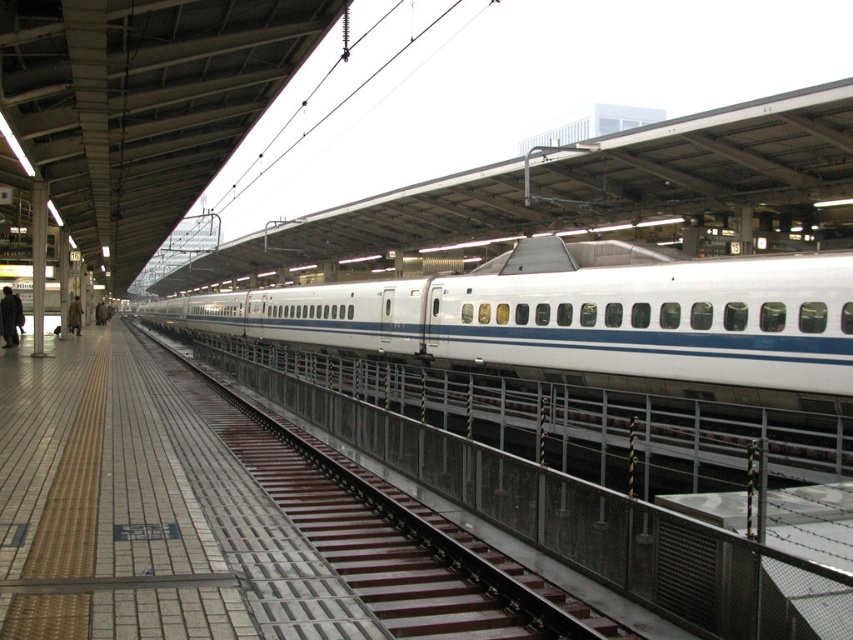
Question: Is dark clothing at platform left thinner than brown leather coat at left?

Choices:
 (A) yes
 (B) no

Answer: (A)

Question: Is white smooth passenger train at center wider than dark clothing at platform left?

Choices:
 (A) no
 (B) yes

Answer: (B)

Question: Which of these objects is positioned closest to the white smooth passenger train at center?

Choices:
 (A) dark clothing at platform left
 (B) brown leather coat at left

Answer: (B)

Question: Is white smooth passenger train at center positioned behind dark clothing at platform left?

Choices:
 (A) yes
 (B) no

Answer: (B)

Question: Which of the following is the farthest from the observer?

Choices:
 (A) dark clothing at platform left
 (B) white smooth passenger train at center
 (C) brown leather coat at left

Answer: (C)

Question: Which point is farther from the camera taking this photo?

Choices:
 (A) (517, 348)
 (B) (18, 310)

Answer: (B)